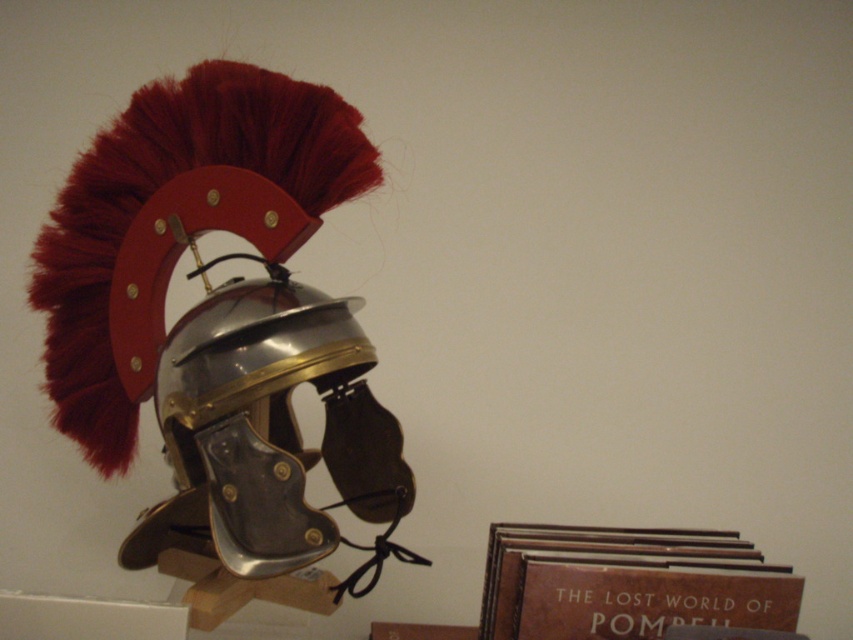
You are a museum curator arranging artifacts. The metallic silver helmet at center and the brown leather book at lower right must be placed on a shelf. The shelf has a maximum length of 12 inches. Can both items fit side by side without overlapping?

The metallic silver helmet at center is 10.73 inches from the brown leather book at lower right. Since the distance between them is less than the shelf length of 12 inches, both items can fit side by side without overlapping.

Where is the metallic silver helmet at center located in the image?

The metallic silver helmet at center is located at point (270, 432) in the image.

You are an archivist organizing artifacts. You see the metallic silver helmet at center and the brown leather book at lower right. Which artifact is positioned higher in the display?

The metallic silver helmet at center is positioned higher than the brown leather book at lower right.